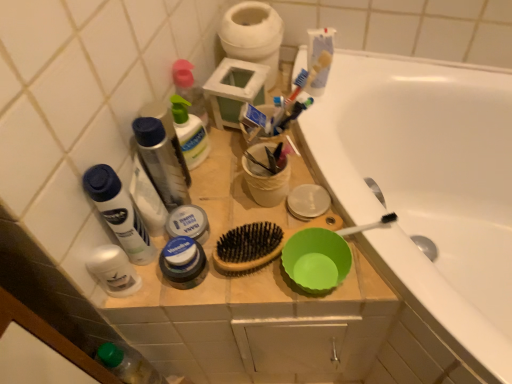
Identify the location of free space behind metallic silver bowl at upper right, the second basin positioned from the top. The image size is (512, 384). (291, 156).